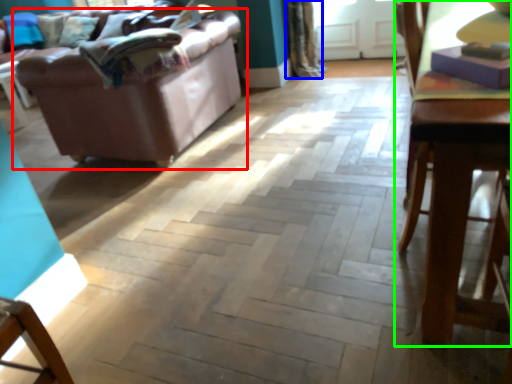
Question: Which object is the closest to the studio couch (highlighted by a red box)? Choose among these: curtain (highlighted by a blue box) or table (highlighted by a green box).

Choices:
 (A) curtain
 (B) table

Answer: (A)